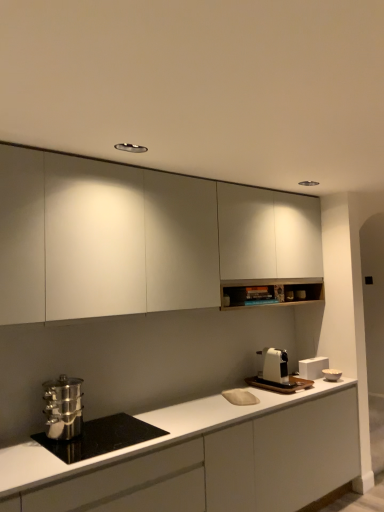
At what (x,y) coordinates should I click in order to perform the action: click on white matte toaster at right, acting as the 2th appliance starting from the right. Please return your answer as a coordinate pair (x, y). The width and height of the screenshot is (384, 512). Looking at the image, I should click on (313, 367).

Image resolution: width=384 pixels, height=512 pixels. Identify the location of white plastic coffee machine at right, which is the 1th kitchen appliance from back to front. (274, 365).

The height and width of the screenshot is (512, 384). Identify the location of stainless steel pot at lower left. (100, 437).

What do you see at coordinates (208, 456) in the screenshot? This screenshot has height=512, width=384. I see `white matte countertop at lower left, which appears as the 1th cabinetry when ordered from the bottom` at bounding box center [208, 456].

The height and width of the screenshot is (512, 384). What do you see at coordinates (63, 408) in the screenshot?
I see `stainless steel steamer at lower left, acting as the second kitchen appliance starting from the back` at bounding box center [63, 408].

The image size is (384, 512). I want to click on white matte cabinet at upper center, which is counted as the second cabinetry, starting from the bottom, so click(x=139, y=238).

You are a GUI agent. You are given a task and a screenshot of the screen. Output one action in this format:
    pyautogui.click(x=<x>, y=<y>)
    Task: Click on the white matte toaster at right, acting as the 2th appliance starting from the right
    
    Given the screenshot: What is the action you would take?
    pyautogui.click(x=313, y=367)

In the image, is white matte cabinet at upper center, which appears as the 1th cabinetry when viewed from the top, on the left side or the right side of white matte toaster at right, acting as the 2th appliance starting from the right?

white matte cabinet at upper center, which appears as the 1th cabinetry when viewed from the top, is positioned on white matte toaster at right, acting as the 2th appliance starting from the right,'s left side.

Is there a large distance between white matte cabinet at upper center, which is counted as the second cabinetry, starting from the bottom, and white matte toaster at right, acting as the 2th appliance starting from the right?

Yes.

Does white matte cabinet at upper center, which appears as the 1th cabinetry when viewed from the top, have a lesser height compared to white matte toaster at right, acting as the 2th appliance starting from the right?

No, white matte cabinet at upper center, which appears as the 1th cabinetry when viewed from the top, is not shorter than white matte toaster at right, acting as the 2th appliance starting from the right.

Is white matte cabinet at upper center, which is counted as the second cabinetry, starting from the bottom, oriented away from white matte toaster at right, acting as the 2th appliance starting from the right?

No, white matte cabinet at upper center, which is counted as the second cabinetry, starting from the bottom, is not facing the opposite direction of white matte toaster at right, acting as the 2th appliance starting from the right.

Could you tell me if stainless steel steamer at lower left, the 2th kitchen appliance in the right-to-left sequence, is facing white matte cabinet at upper center, which is counted as the second cabinetry, starting from the bottom?

No.

Which is in front, point (80, 424) or point (83, 193)?

The point (83, 193) is closer to the camera.

From the image's perspective, is stainless steel steamer at lower left, the 1th kitchen appliance in the left-to-right sequence, on white matte cabinet at upper center, which appears as the 1th cabinetry when viewed from the top?

No, from the image's perspective, stainless steel steamer at lower left, the 1th kitchen appliance in the left-to-right sequence, is not on top of white matte cabinet at upper center, which appears as the 1th cabinetry when viewed from the top.

Considering the relative sizes of stainless steel steamer at lower left, the 1th kitchen appliance in the left-to-right sequence, and white matte cabinet at upper center, which appears as the 1th cabinetry when viewed from the top, in the image provided, is stainless steel steamer at lower left, the 1th kitchen appliance in the left-to-right sequence, shorter than white matte cabinet at upper center, which appears as the 1th cabinetry when viewed from the top,?

Correct, stainless steel steamer at lower left, the 1th kitchen appliance in the left-to-right sequence, is not as tall as white matte cabinet at upper center, which appears as the 1th cabinetry when viewed from the top.

Considering the sizes of objects white matte toaster at right, which ranks as the 1th appliance in left-to-right order, and stainless steel pot at lower left in the image provided, who is shorter, white matte toaster at right, which ranks as the 1th appliance in left-to-right order, or stainless steel pot at lower left?

stainless steel pot at lower left.

In the scene shown: From the image's perspective, which object appears higher, white matte toaster at right, acting as the 2th appliance starting from the right, or stainless steel pot at lower left?

white matte toaster at right, acting as the 2th appliance starting from the right, appears higher in the image.

How many degrees apart are the facing directions of white matte toaster at right, which ranks as the 1th appliance in left-to-right order, and stainless steel pot at lower left?

There is a 0.00525-degree angle between the facing directions of white matte toaster at right, which ranks as the 1th appliance in left-to-right order, and stainless steel pot at lower left.

Can you confirm if white matte countertop at lower left, which appears as the 1th cabinetry when ordered from the bottom, is smaller than white matte toaster at right, which ranks as the 1th appliance in left-to-right order?

No, white matte countertop at lower left, which appears as the 1th cabinetry when ordered from the bottom, is not smaller than white matte toaster at right, which ranks as the 1th appliance in left-to-right order.

Between white matte countertop at lower left, the 2th cabinetry from the top, and white matte toaster at right, acting as the 2th appliance starting from the right, which one is positioned in front?

white matte countertop at lower left, the 2th cabinetry from the top.

Is white matte countertop at lower left, which appears as the 1th cabinetry when ordered from the bottom, taller or shorter than white matte toaster at right, which ranks as the 1th appliance in left-to-right order?

Considering their sizes, white matte countertop at lower left, which appears as the 1th cabinetry when ordered from the bottom, has more height than white matte toaster at right, which ranks as the 1th appliance in left-to-right order.

Considering the sizes of objects stainless steel pot at lower left and white matte countertop at lower left, which appears as the 1th cabinetry when ordered from the bottom, in the image provided, who is wider, stainless steel pot at lower left or white matte countertop at lower left, which appears as the 1th cabinetry when ordered from the bottom,?

With larger width is white matte countertop at lower left, which appears as the 1th cabinetry when ordered from the bottom.

Is stainless steel pot at lower left next to white matte countertop at lower left, the 2th cabinetry from the top?

stainless steel pot at lower left and white matte countertop at lower left, the 2th cabinetry from the top, are not in contact.

Is stainless steel pot at lower left inside the boundaries of white matte countertop at lower left, the 2th cabinetry from the top, or outside?

stainless steel pot at lower left is enclosed within white matte countertop at lower left, the 2th cabinetry from the top.

From the image's perspective, which is above, stainless steel pot at lower left or white matte countertop at lower left, which appears as the 1th cabinetry when ordered from the bottom?

stainless steel pot at lower left appears higher in the image.

Does stainless steel pot at lower left appear on the right side of white plastic coffee machine at right, which is the 1th kitchen appliance from back to front?

No.

Does stainless steel pot at lower left touch white plastic coffee machine at right, placed as the 2th kitchen appliance when sorted from left to right?

No, stainless steel pot at lower left is not touching white plastic coffee machine at right, placed as the 2th kitchen appliance when sorted from left to right.

In terms of width, does stainless steel pot at lower left look wider or thinner when compared to white plastic coffee machine at right, marked as the 2th kitchen appliance in a front-to-back arrangement?

Considering their sizes, stainless steel pot at lower left looks broader than white plastic coffee machine at right, marked as the 2th kitchen appliance in a front-to-back arrangement.

Is stainless steel pot at lower left turned away from white plastic coffee machine at right, placed as the 2th kitchen appliance when sorted from left to right?

No, stainless steel pot at lower left is not facing the opposite direction of white plastic coffee machine at right, placed as the 2th kitchen appliance when sorted from left to right.

From a real-world perspective, which object stands above the other?

white glossy bowl at right, which ranks as the second appliance in left-to-right order, is physically above.

Which object is positioned more to the right, white glossy bowl at right, which ranks as the second appliance in left-to-right order, or stainless steel pot at lower left?

white glossy bowl at right, which ranks as the second appliance in left-to-right order, is more to the right.

Is white glossy bowl at right, which ranks as the second appliance in left-to-right order, next to stainless steel pot at lower left and touching it?

They are not placed beside each other.

Consider the image. Can you confirm if white glossy bowl at right, which ranks as the second appliance in left-to-right order, is thinner than stainless steel pot at lower left?

Yes.

Where is `the 2nd appliance behind when counting from the white matte cabinet at upper center, which appears as the 1th cabinetry when viewed from the top`? the 2nd appliance behind when counting from the white matte cabinet at upper center, which appears as the 1th cabinetry when viewed from the top is located at coordinates (313, 367).

Image resolution: width=384 pixels, height=512 pixels. In order to click on kitchen appliance that is the 1st object located below the white matte cabinet at upper center, which appears as the 1th cabinetry when viewed from the top (from the image's perspective) in this screenshot , I will do `click(63, 408)`.

Based on their spatial positions, is stainless steel steamer at lower left, the 2th kitchen appliance in the right-to-left sequence, or white matte countertop at lower left, which appears as the 1th cabinetry when ordered from the bottom, further from white matte toaster at right, which ranks as the 1th appliance in left-to-right order?

Among the two, stainless steel steamer at lower left, the 2th kitchen appliance in the right-to-left sequence, is located further to white matte toaster at right, which ranks as the 1th appliance in left-to-right order.

Estimate the real-world distances between objects in this image. Which object is further from white matte toaster at right, which ranks as the 1th appliance in left-to-right order, stainless steel pot at lower left or white plastic coffee machine at right, placed as the 2th kitchen appliance when sorted from left to right?

stainless steel pot at lower left lies further to white matte toaster at right, which ranks as the 1th appliance in left-to-right order, than the other object.

When comparing their distances from white matte countertop at lower left, which appears as the 1th cabinetry when ordered from the bottom, does white matte toaster at right, acting as the 2th appliance starting from the right, or stainless steel steamer at lower left, placed as the 1th kitchen appliance when sorted from front to back, seem closer?

The object closer to white matte countertop at lower left, which appears as the 1th cabinetry when ordered from the bottom, is stainless steel steamer at lower left, placed as the 1th kitchen appliance when sorted from front to back.

Looking at the image, which one is located further to white glossy bowl at right, the 1th appliance viewed from the right, white matte toaster at right, acting as the 2th appliance starting from the right, or white plastic coffee machine at right, marked as the 2th kitchen appliance in a front-to-back arrangement?

The object further to white glossy bowl at right, the 1th appliance viewed from the right, is white plastic coffee machine at right, marked as the 2th kitchen appliance in a front-to-back arrangement.

Based on their spatial positions, is white matte countertop at lower left, which appears as the 1th cabinetry when ordered from the bottom, or stainless steel steamer at lower left, placed as the 1th kitchen appliance when sorted from front to back, further from white glossy bowl at right, the 1th appliance viewed from the right?

stainless steel steamer at lower left, placed as the 1th kitchen appliance when sorted from front to back, is positioned further to the anchor white glossy bowl at right, the 1th appliance viewed from the right.

Which object lies nearer to the anchor point stainless steel pot at lower left, stainless steel steamer at lower left, the 2th kitchen appliance in the right-to-left sequence, or white matte toaster at right, which ranks as the 1th appliance in left-to-right order?

The object closer to stainless steel pot at lower left is stainless steel steamer at lower left, the 2th kitchen appliance in the right-to-left sequence.

When comparing their distances from white matte countertop at lower left, which appears as the 1th cabinetry when ordered from the bottom, does white glossy bowl at right, the 1th appliance viewed from the right, or white matte cabinet at upper center, which is counted as the second cabinetry, starting from the bottom, seem further?

white glossy bowl at right, the 1th appliance viewed from the right, lies further to white matte countertop at lower left, which appears as the 1th cabinetry when ordered from the bottom, than the other object.

When comparing their distances from stainless steel pot at lower left, does white matte cabinet at upper center, which is counted as the second cabinetry, starting from the bottom, or stainless steel steamer at lower left, the 2th kitchen appliance in the right-to-left sequence, seem closer?

The object closer to stainless steel pot at lower left is stainless steel steamer at lower left, the 2th kitchen appliance in the right-to-left sequence.

The height and width of the screenshot is (512, 384). What are the coordinates of `cabinetry between white matte countertop at lower left, the 2th cabinetry from the top, and white glossy bowl at right, the 1th appliance viewed from the right, in the front-back direction` in the screenshot? It's located at [139, 238].

Find the location of a particular element. The image size is (384, 512). cabinetry between stainless steel pot at lower left and white plastic coffee machine at right, acting as the 1th kitchen appliance starting from the right, from front to back is located at coordinates point(139,238).

Find the location of a particular element. kitchen appliance situated between stainless steel steamer at lower left, the 1th kitchen appliance in the left-to-right sequence, and white matte toaster at right, acting as the 2th appliance starting from the right, from left to right is located at coordinates (274, 365).

Image resolution: width=384 pixels, height=512 pixels. Identify the location of home appliance situated between stainless steel steamer at lower left, the 2th kitchen appliance in the right-to-left sequence, and white plastic coffee machine at right, marked as the 2th kitchen appliance in a front-to-back arrangement, from left to right. (100, 437).